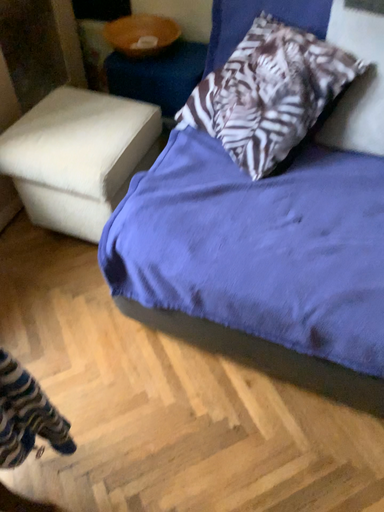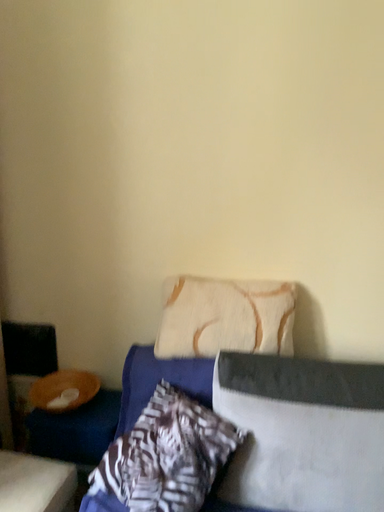
Question: How did the camera likely rotate when shooting the video?

Choices:
 (A) rotated right
 (B) rotated left

Answer: (A)